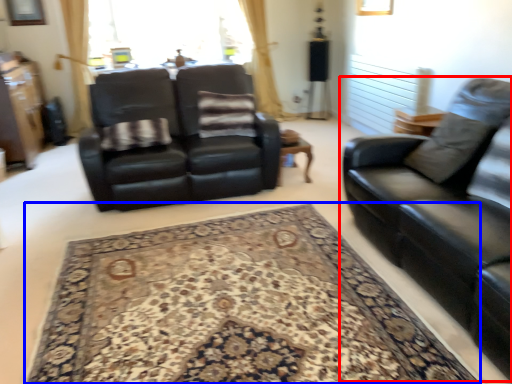
Question: Which of the following is the farthest to the observer, studio couch (highlighted by a red box) or mat (highlighted by a blue box)?

Choices:
 (A) studio couch
 (B) mat

Answer: (B)